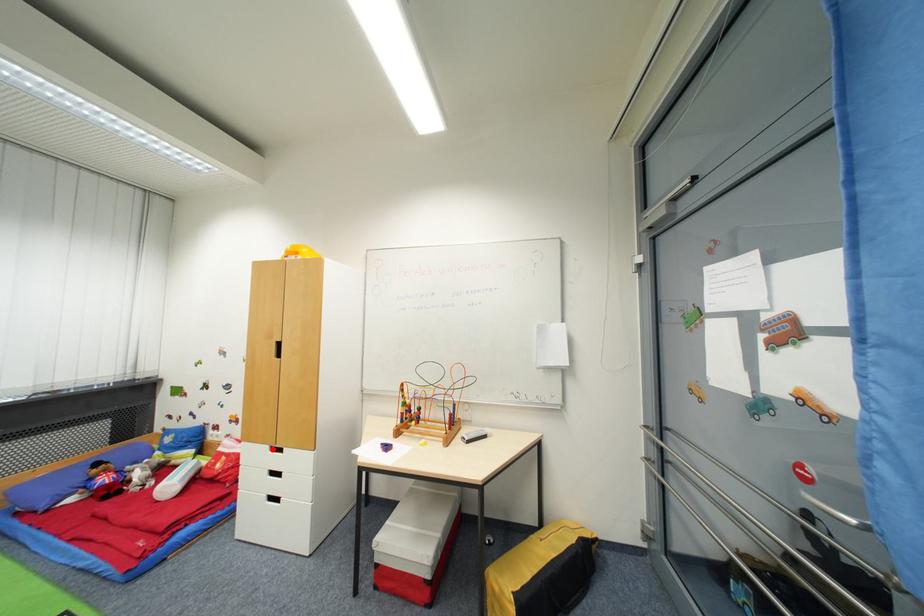
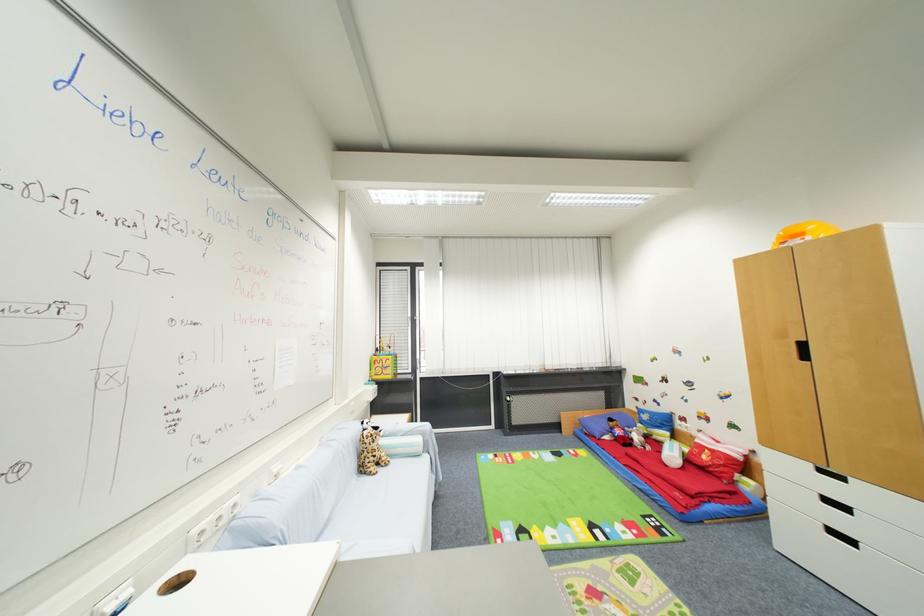
Question: I am providing you with two images of the same scene from different viewpoints. A red point is marked on the first image. Can you still see the location of the red point in image 2?

Choices:
 (A) Yes
 (B) No

Answer: (A)